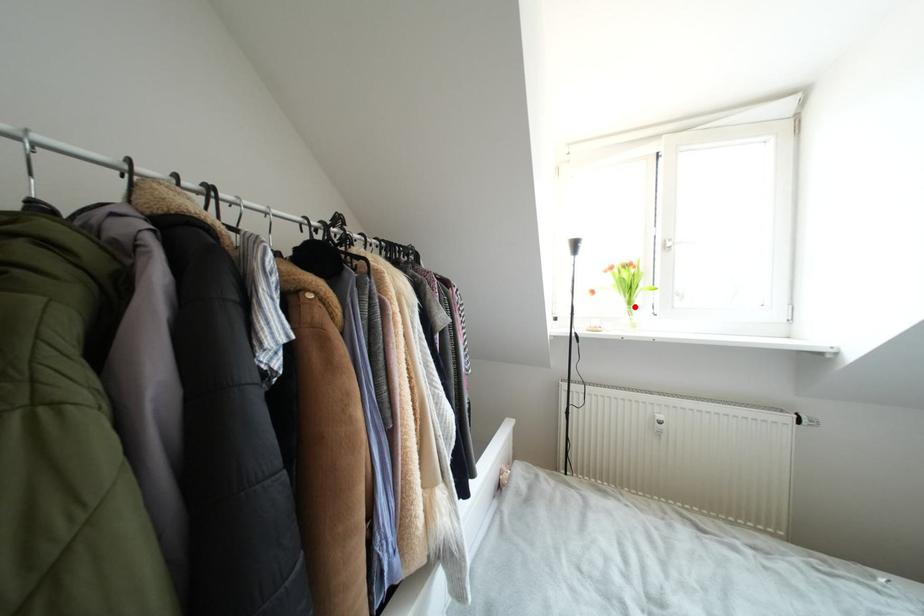
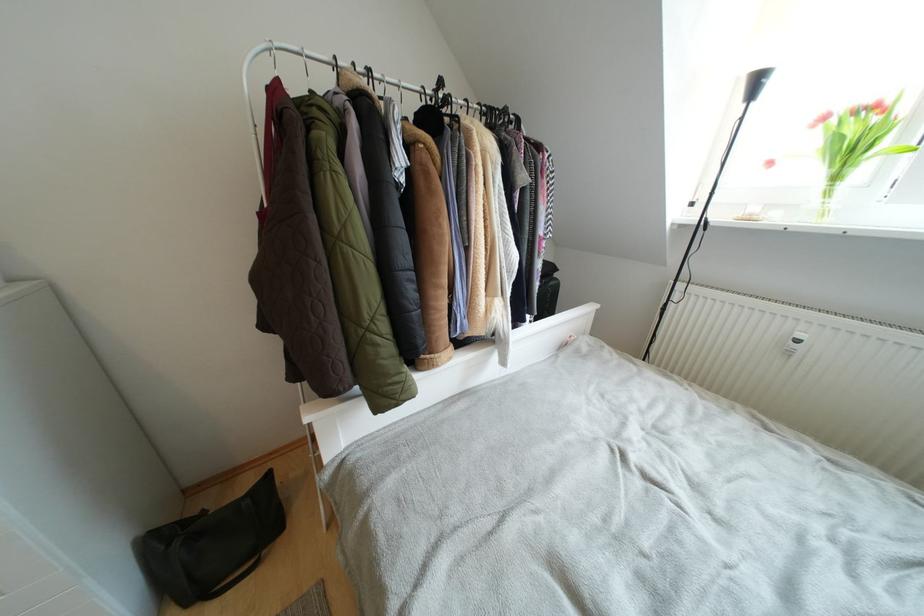
In the second image, find the point that corresponds to the highlighted location in the first image.

(840, 182)